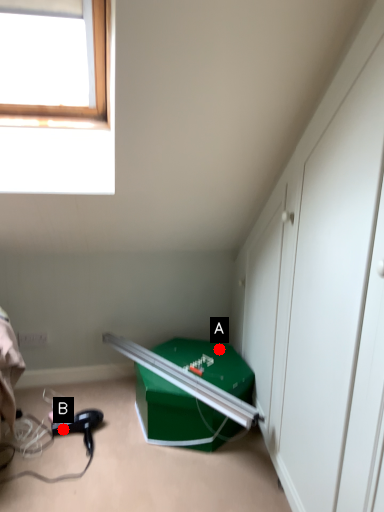
Question: Two points are circled on the image, labeled by A and B beside each circle. Which of the following is the closest to the observer?

Choices:
 (A) A is closer
 (B) B is closer

Answer: (B)